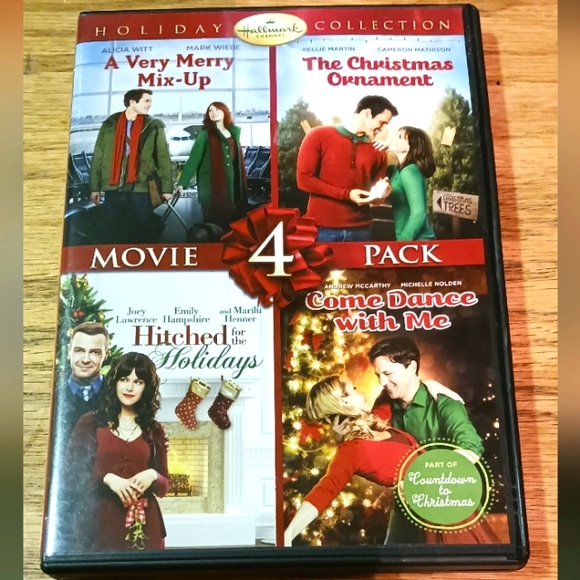
Identify the location of christmas trees. This screenshot has height=580, width=580. (85, 309), (314, 348), (463, 150), (292, 136).